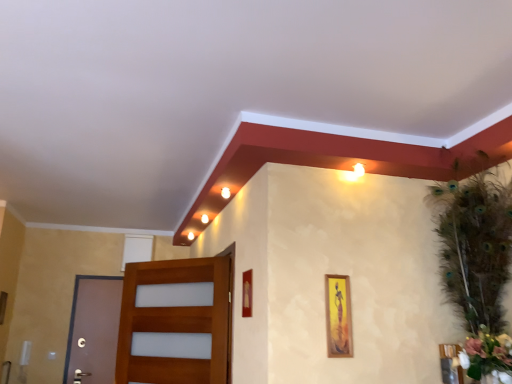
Locate an element on the screen. wooden picture frame at lower right, the 1th picture frame viewed from the right is located at coordinates (450, 364).

Identify the location of wooden picture frame at lower right, the 1th picture frame viewed from the right. (450, 364).

Considering the sizes of wooden picture frame at lower right, positioned as the third picture frame in left-to-right order, and wooden door at left, arranged as the 2th door when viewed from the back, in the image, is wooden picture frame at lower right, positioned as the third picture frame in left-to-right order, bigger or smaller than wooden door at left, arranged as the 2th door when viewed from the back,?

Considering their sizes, wooden picture frame at lower right, positioned as the third picture frame in left-to-right order, takes up less space than wooden door at left, arranged as the 2th door when viewed from the back.

Is wooden door at left, positioned as the 1th door in front-to-back order, inside wooden picture frame at lower right, the 1th picture frame viewed from the right?

No, wooden door at left, positioned as the 1th door in front-to-back order, is not a part of wooden picture frame at lower right, the 1th picture frame viewed from the right.

Is wooden picture frame at lower right, positioned as the third picture frame in left-to-right order, positioned in front of wooden door at left, marked as the second door in a left-to-right arrangement?

Yes, wooden picture frame at lower right, positioned as the third picture frame in left-to-right order, is in front of wooden door at left, marked as the second door in a left-to-right arrangement.

Which is more to the left, wooden picture frame at lower right, positioned as the third picture frame in left-to-right order, or wooden door at left, positioned as the 1th door in front-to-back order?

wooden door at left, positioned as the 1th door in front-to-back order.

Can you confirm if wooden picture frame at lower right, positioned as the third picture frame in left-to-right order, is wider than white matte flower at right?

No, wooden picture frame at lower right, positioned as the third picture frame in left-to-right order, is not wider than white matte flower at right.

From the image's perspective, is wooden picture frame at lower right, positioned as the third picture frame in left-to-right order, on top of white matte flower at right?

Actually, wooden picture frame at lower right, positioned as the third picture frame in left-to-right order, appears below white matte flower at right in the image.

The height and width of the screenshot is (384, 512). In order to click on picture frame that appears below the white matte flower at right (from a real-world perspective) in this screenshot , I will do `click(450, 364)`.

Which is more to the left, wooden picture frame at lower right, positioned as the third picture frame in left-to-right order, or white matte flower at right?

Positioned to the left is wooden picture frame at lower right, positioned as the third picture frame in left-to-right order.

Is matte gold picture frame at center, which is the third picture frame from right to left, at the back of wooden picture frame at lower right, positioned as the third picture frame in left-to-right order?

No, wooden picture frame at lower right, positioned as the third picture frame in left-to-right order,'s orientation is not away from matte gold picture frame at center, which is the third picture frame from right to left.

Does wooden picture frame at lower right, the 1th picture frame viewed from the right, have a lesser height compared to matte gold picture frame at center, which appears as the 1th picture frame when viewed from the left?

In fact, wooden picture frame at lower right, the 1th picture frame viewed from the right, may be taller than matte gold picture frame at center, which appears as the 1th picture frame when viewed from the left.

Who is more distant, wooden picture frame at lower right, the 1th picture frame viewed from the right, or matte gold picture frame at center, which appears as the 1th picture frame when viewed from the left?

Positioned behind is matte gold picture frame at center, which appears as the 1th picture frame when viewed from the left.

From their relative heights in the image, would you say wooden picture frame at center-right, the 2th picture frame positioned from the left, is taller or shorter than white matte flower at right?

Clearly, wooden picture frame at center-right, the 2th picture frame positioned from the left, is taller compared to white matte flower at right.

From a real-world perspective, between wooden picture frame at center-right, the second picture frame viewed from the right, and white matte flower at right, who is vertically higher?

From a 3D spatial view, wooden picture frame at center-right, the second picture frame viewed from the right, is above.

Would you say wooden picture frame at center-right, the second picture frame viewed from the right, is to the left or to the right of white matte flower at right in the picture?

Based on their positions, wooden picture frame at center-right, the second picture frame viewed from the right, is located to the left of white matte flower at right.

Between wooden picture frame at center-right, the 2th picture frame positioned from the left, and white matte flower at right, which one has larger size?

With larger size is white matte flower at right.

From a real-world perspective, is wooden picture frame at center-right, the 2th picture frame positioned from the left, physically located above or below wooden picture frame at lower right, the 1th picture frame viewed from the right?

wooden picture frame at center-right, the 2th picture frame positioned from the left, is above wooden picture frame at lower right, the 1th picture frame viewed from the right.

Is wooden picture frame at center-right, the 2th picture frame positioned from the left, at the right side of wooden picture frame at lower right, positioned as the third picture frame in left-to-right order?

Incorrect, wooden picture frame at center-right, the 2th picture frame positioned from the left, is not on the right side of wooden picture frame at lower right, positioned as the third picture frame in left-to-right order.

Considering the sizes of objects wooden picture frame at center-right, the 2th picture frame positioned from the left, and wooden picture frame at lower right, positioned as the third picture frame in left-to-right order, in the image provided, who is smaller, wooden picture frame at center-right, the 2th picture frame positioned from the left, or wooden picture frame at lower right, positioned as the third picture frame in left-to-right order,?

wooden picture frame at center-right, the 2th picture frame positioned from the left.

Locate an element on the screen. picture frame that is the 1st object located above the wooden picture frame at lower right, positioned as the third picture frame in left-to-right order (from the image's perspective) is located at coordinates (338, 316).

Could you tell me if white matte flower at right is turned towards wooden picture frame at lower right, the 1th picture frame viewed from the right?

No.

Is white matte flower at right taller or shorter than wooden picture frame at lower right, positioned as the third picture frame in left-to-right order?

Considering their sizes, white matte flower at right has less height than wooden picture frame at lower right, positioned as the third picture frame in left-to-right order.

From the image's perspective, is white matte flower at right under wooden picture frame at lower right, the 1th picture frame viewed from the right?

No, from the image's perspective, white matte flower at right is not below wooden picture frame at lower right, the 1th picture frame viewed from the right.

From a real-world perspective, is white matte flower at right on top of wooden picture frame at lower right, the 1th picture frame viewed from the right?

Yes.

Does wooden picture frame at center-right, the second picture frame viewed from the right, come in front of matte gold picture frame at center, which is the third picture frame from right to left?

Yes, wooden picture frame at center-right, the second picture frame viewed from the right, is closer to the viewer.

Is wooden picture frame at center-right, the 2th picture frame positioned from the left, positioned far away from matte gold picture frame at center, which appears as the 1th picture frame when viewed from the left?

No.

Based on their positions, is wooden picture frame at center-right, the second picture frame viewed from the right, located to the left or right of matte gold picture frame at center, which appears as the 1th picture frame when viewed from the left?

wooden picture frame at center-right, the second picture frame viewed from the right, is to the right of matte gold picture frame at center, which appears as the 1th picture frame when viewed from the left.

In the scene shown: From their relative heights in the image, would you say wooden picture frame at center-right, the 2th picture frame positioned from the left, is taller or shorter than matte gold picture frame at center, which is the third picture frame from right to left?

wooden picture frame at center-right, the 2th picture frame positioned from the left, is taller than matte gold picture frame at center, which is the third picture frame from right to left.

Locate an element on the screen. The width and height of the screenshot is (512, 384). picture frame below the wooden door at left, arranged as the 2th door when viewed from the back (from the image's perspective) is located at coordinates (450, 364).

Where is `flower that appears in front of the wooden picture frame at lower right, positioned as the third picture frame in left-to-right order`? Image resolution: width=512 pixels, height=384 pixels. flower that appears in front of the wooden picture frame at lower right, positioned as the third picture frame in left-to-right order is located at coordinates (487, 356).

Looking at the image, which one is located closer to wooden picture frame at center-right, the 2th picture frame positioned from the left, wooden door at left, arranged as the 2th door when viewed from the back, or white matte flower at right?

white matte flower at right is closer to wooden picture frame at center-right, the 2th picture frame positioned from the left.

Estimate the real-world distances between objects in this image. Which object is closer to white matte flower at right, wooden door at left, marked as the second door in a left-to-right arrangement, or wooden picture frame at lower right, the 1th picture frame viewed from the right?

wooden picture frame at lower right, the 1th picture frame viewed from the right, lies closer to white matte flower at right than the other object.

From the image, which object appears to be farther from wooden picture frame at center-right, the second picture frame viewed from the right, wooden picture frame at lower right, the 1th picture frame viewed from the right, or white matte flower at right?

Among the two, white matte flower at right is located further to wooden picture frame at center-right, the second picture frame viewed from the right.

Which object lies nearer to the anchor point wooden picture frame at lower right, the 1th picture frame viewed from the right, matte gold picture frame at center, which appears as the 1th picture frame when viewed from the left, or wooden door at left, which appears as the 1th door when viewed from the right?

matte gold picture frame at center, which appears as the 1th picture frame when viewed from the left.

Estimate the real-world distances between objects in this image. Which object is closer to brown matte door at left, the second door positioned from the front, wooden picture frame at lower right, the 1th picture frame viewed from the right, or white matte flower at right?

Based on the image, wooden picture frame at lower right, the 1th picture frame viewed from the right, appears to be nearer to brown matte door at left, the second door positioned from the front.

Estimate the real-world distances between objects in this image. Which object is closer to white matte flower at right, brown matte door at left, acting as the 1th door starting from the left, or wooden door at left, arranged as the 2th door when viewed from the back?

wooden door at left, arranged as the 2th door when viewed from the back, is closer to white matte flower at right.

From the image, which object appears to be nearer to wooden picture frame at center-right, the second picture frame viewed from the right, wooden door at left, arranged as the 2th door when viewed from the back, or wooden picture frame at lower right, the 1th picture frame viewed from the right?

wooden picture frame at lower right, the 1th picture frame viewed from the right, lies closer to wooden picture frame at center-right, the second picture frame viewed from the right, than the other object.

Based on their spatial positions, is brown matte door at left, the first door when ordered from back to front, or wooden picture frame at center-right, the 2th picture frame positioned from the left, closer to matte gold picture frame at center, which appears as the 1th picture frame when viewed from the left?

wooden picture frame at center-right, the 2th picture frame positioned from the left.

This screenshot has height=384, width=512. I want to click on picture frame between wooden picture frame at center-right, the 2th picture frame positioned from the left, and white matte flower at right, so pyautogui.click(x=450, y=364).

Where is `door between brown matte door at left, the first door when ordered from back to front, and wooden picture frame at center-right, the second picture frame viewed from the right, in the horizontal direction`? This screenshot has width=512, height=384. door between brown matte door at left, the first door when ordered from back to front, and wooden picture frame at center-right, the second picture frame viewed from the right, in the horizontal direction is located at coordinates (175, 322).

Image resolution: width=512 pixels, height=384 pixels. What are the coordinates of `picture frame between brown matte door at left, acting as the 1th door starting from the left, and wooden picture frame at center-right, the 2th picture frame positioned from the left, from left to right` in the screenshot? It's located at (247, 293).

At what (x,y) coordinates should I click in order to perform the action: click on door situated between brown matte door at left, the second door positioned from the front, and wooden picture frame at lower right, the 1th picture frame viewed from the right, from left to right. Please return your answer as a coordinate pair (x, y). The width and height of the screenshot is (512, 384). Looking at the image, I should click on [x=175, y=322].